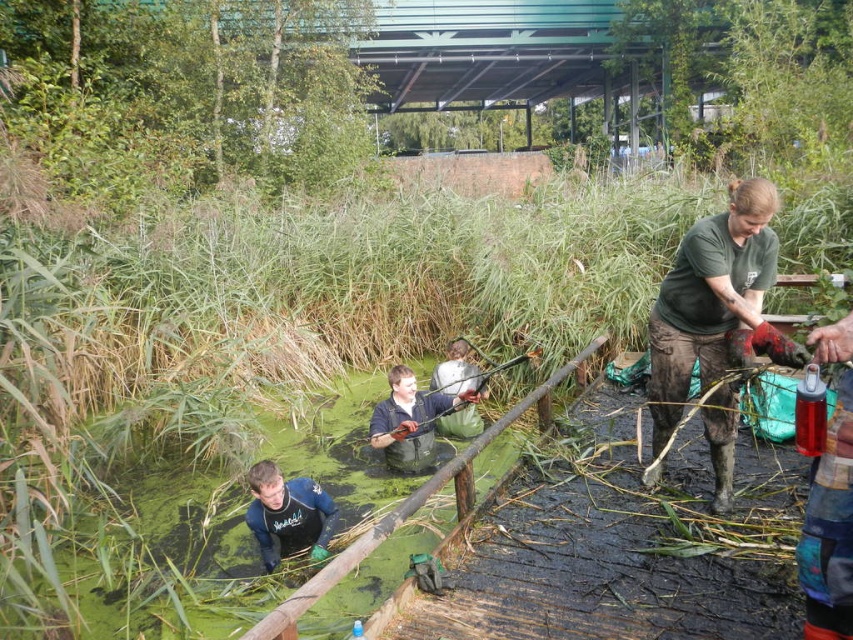
Question: Which point appears farthest from the camera in this image?

Choices:
 (A) (764, 180)
 (B) (408, 404)
 (C) (276, 512)

Answer: (B)

Question: Which object appears closest to the camera in this image?

Choices:
 (A) dark blue wetsuit at lower center
 (B) green matte shirt at right
 (C) dark green rubber waders at center

Answer: (B)

Question: Which object is farther from the camera taking this photo?

Choices:
 (A) dark green rubber waders at center
 (B) green matte shirt at right

Answer: (A)

Question: Is green matte shirt at right further to camera compared to dark blue wetsuit at lower center?

Choices:
 (A) no
 (B) yes

Answer: (A)

Question: Can you confirm if green matte shirt at right is positioned to the right of dark blue wetsuit at lower center?

Choices:
 (A) no
 (B) yes

Answer: (B)

Question: Is the position of dark blue wetsuit at lower center less distant than that of dark green rubber waders at center?

Choices:
 (A) yes
 (B) no

Answer: (A)